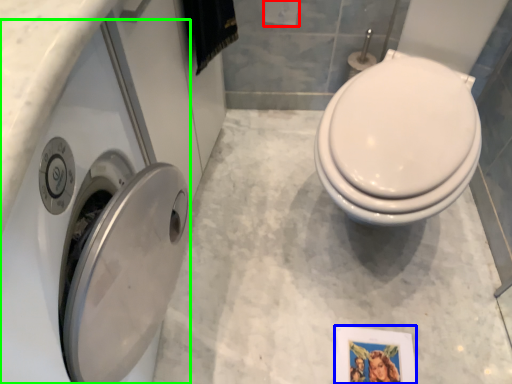
Question: Considering the real-world distances, which object is closest to toilet paper (highlighted by a red box)? picture frame (highlighted by a blue box) or washer (highlighted by a green box).

Choices:
 (A) picture frame
 (B) washer

Answer: (B)